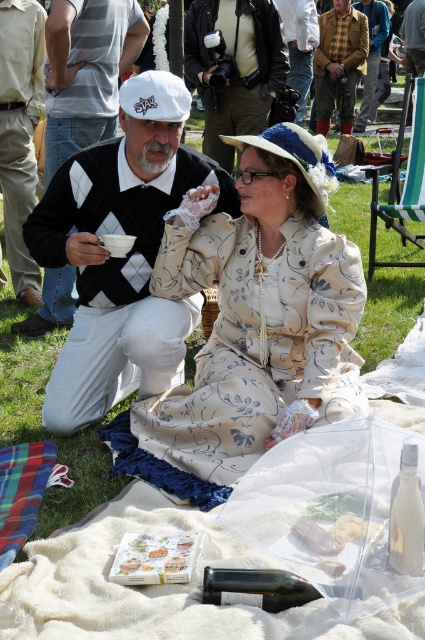
You are at a vintage themed event and want to take a photo of the beige floral dress at center and the matte black camera at upper center. Which object is positioned to the right of the other?

The beige floral dress at center is positioned to the right of the matte black camera at upper center.

You are a photographer at a vintage picnic and need to decide which item to use next. You have a matte black camera at upper center and a printed paper napkin at lower center. Which item is larger in size?

The matte black camera at upper center is bigger than the printed paper napkin at lower center, so the matte black camera at upper center is the larger item.

You are organizing a costume party and need to decide which garment takes up more space in your storage. Based on the image, which item is larger between the argyle sweater at left and the khaki cotton pants at lower left?

The argyle sweater at left is larger in size than the khaki cotton pants at lower left, so it takes up more storage space.